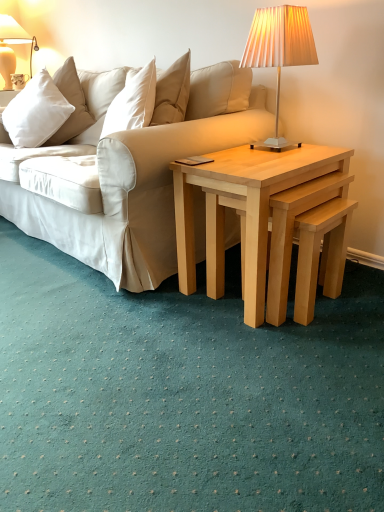
Question: Would you consider white soft cushion at upper left to be distant from light wood/natural wood nesting tables at center?

Choices:
 (A) no
 (B) yes

Answer: (B)

Question: Considering the relative sizes of white soft cushion at upper left and light wood/natural wood nesting tables at center in the image provided, is white soft cushion at upper left smaller than light wood/natural wood nesting tables at center?

Choices:
 (A) yes
 (B) no

Answer: (A)

Question: Does white soft cushion at upper left contain light wood/natural wood nesting tables at center?

Choices:
 (A) yes
 (B) no

Answer: (B)

Question: Is white soft cushion at upper left further to the viewer compared to light wood/natural wood nesting tables at center?

Choices:
 (A) yes
 (B) no

Answer: (A)

Question: Does white soft cushion at upper left have a lesser width compared to light wood/natural wood nesting tables at center?

Choices:
 (A) yes
 (B) no

Answer: (A)

Question: Is white soft cushion at upper left turned away from light wood/natural wood nesting tables at center?

Choices:
 (A) yes
 (B) no

Answer: (B)

Question: Is light wood/natural wood nesting tables at center closer to the viewer compared to white soft cushion at upper left?

Choices:
 (A) yes
 (B) no

Answer: (A)

Question: From a real-world perspective, is light wood/natural wood nesting tables at center under white soft cushion at upper left?

Choices:
 (A) no
 (B) yes

Answer: (B)

Question: Does light wood/natural wood nesting tables at center have a lesser height compared to white soft cushion at upper left?

Choices:
 (A) yes
 (B) no

Answer: (B)

Question: Could you tell me if light wood/natural wood nesting tables at center is turned towards white soft cushion at upper left?

Choices:
 (A) no
 (B) yes

Answer: (A)

Question: Can you confirm if light wood/natural wood nesting tables at center is thinner than white soft cushion at upper left?

Choices:
 (A) yes
 (B) no

Answer: (B)

Question: Considering the relative positions of light wood/natural wood nesting tables at center and white soft cushion at upper left in the image provided, is light wood/natural wood nesting tables at center to the right of white soft cushion at upper left from the viewer's perspective?

Choices:
 (A) yes
 (B) no

Answer: (A)

Question: Is matte cream lampshade at upper right, which ranks as the 1th lamp in bottom-to-top order, positioned before matte white lampshade at upper left, the first lamp when ordered from left to right?

Choices:
 (A) yes
 (B) no

Answer: (A)